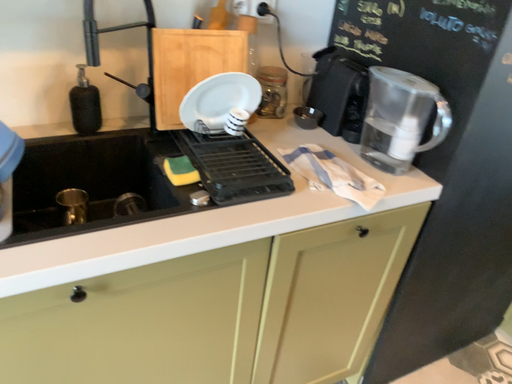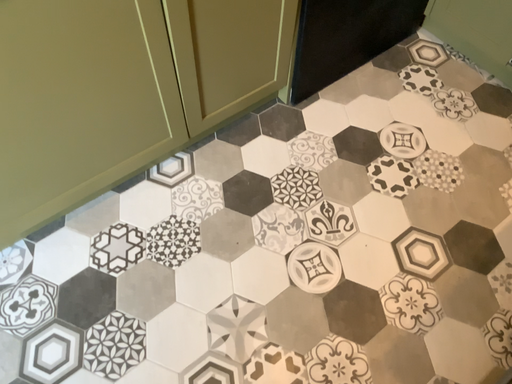
Question: Which way did the camera rotate in the video?

Choices:
 (A) rotated left
 (B) rotated right

Answer: (B)